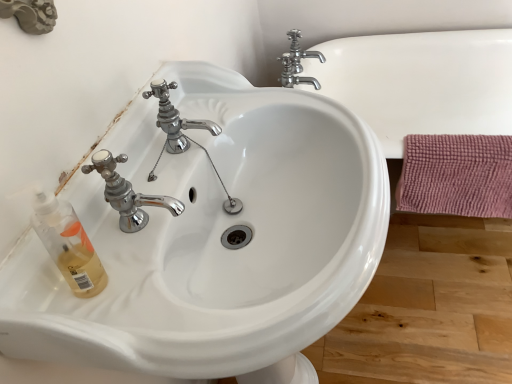
You are a GUI agent. You are given a task and a screenshot of the screen. Output one action in this format:
    pyautogui.click(x=<x>, y=<y>)
    Task: Click on the free space above pink textured bath towel at right (from a real-world perspective)
    This screenshot has height=384, width=512.
    Given the screenshot: What is the action you would take?
    pyautogui.click(x=467, y=142)